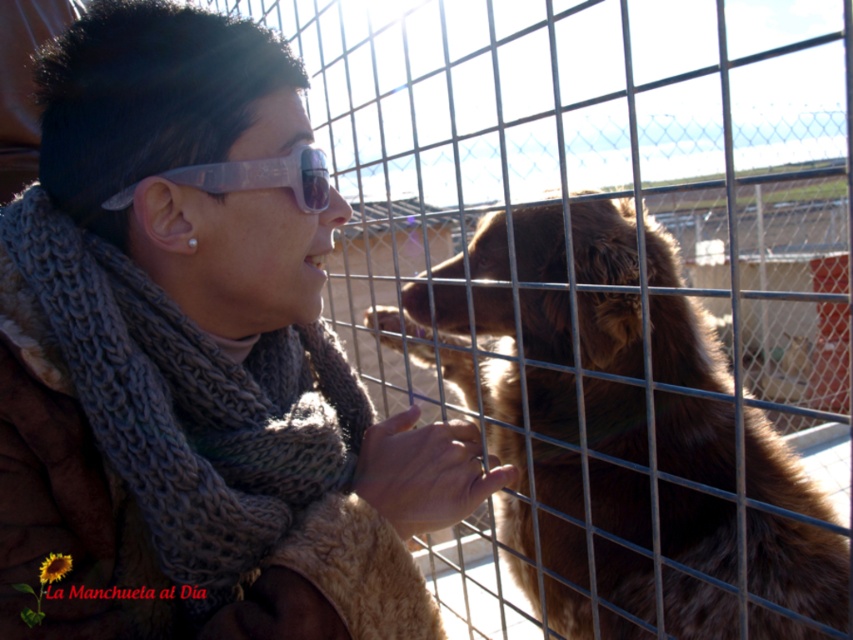
Question: Which object is the farthest from the transparent plastic goggles at upper center?

Choices:
 (A) brown furry dog at center
 (B) knitted scarf at center

Answer: (A)

Question: Which point is farther to the camera?

Choices:
 (A) (126, 454)
 (B) (567, 573)
 (C) (305, 147)

Answer: (B)

Question: Does knitted scarf at center come in front of brown furry dog at center?

Choices:
 (A) yes
 (B) no

Answer: (A)

Question: Does knitted scarf at center have a smaller size compared to transparent plastic goggles at upper center?

Choices:
 (A) no
 (B) yes

Answer: (A)

Question: Among these objects, which one is nearest to the camera?

Choices:
 (A) transparent plastic goggles at upper center
 (B) brown furry dog at center

Answer: (B)

Question: Is brown furry dog at center closer to camera compared to transparent plastic goggles at upper center?

Choices:
 (A) yes
 (B) no

Answer: (A)